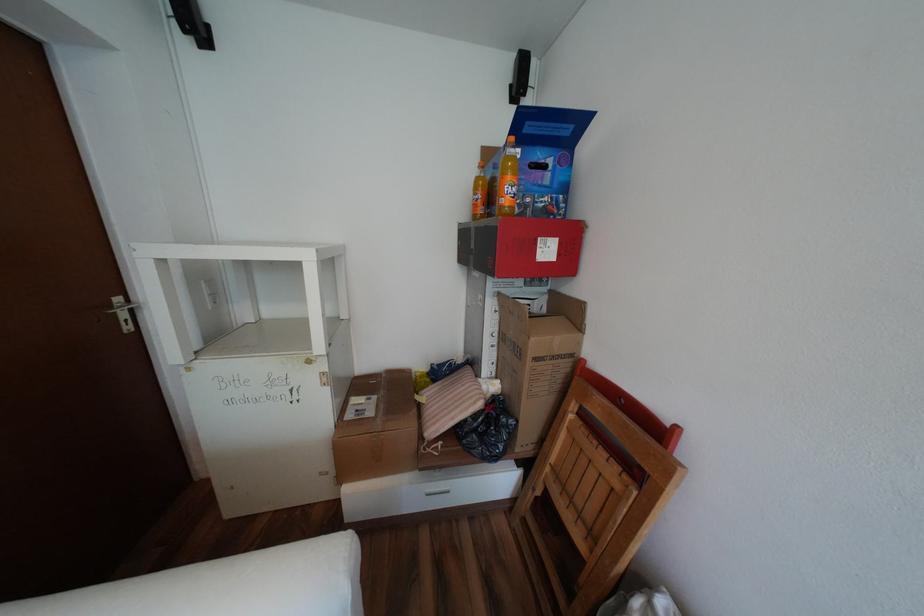
The image size is (924, 616). I want to click on brown cardboard box, so click(x=537, y=362).